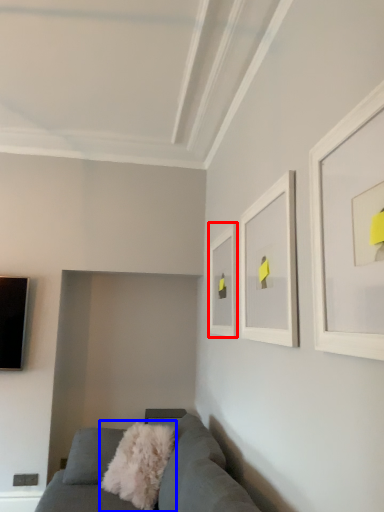
Question: Among these objects, which one is farthest to the camera, picture frame (highlighted by a red box) or throw pillow (highlighted by a blue box)?

Choices:
 (A) picture frame
 (B) throw pillow

Answer: (A)